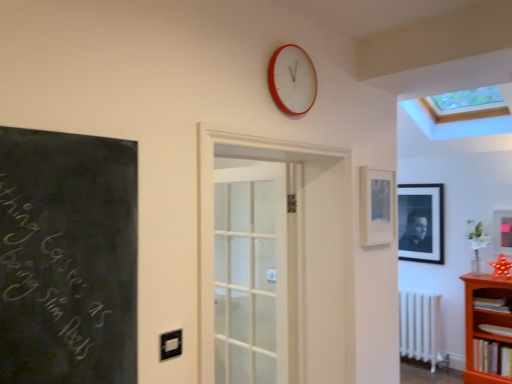
Question: Is transparent glass skylight at upper center outside red plastic wall clock at upper center?

Choices:
 (A) no
 (B) yes

Answer: (B)

Question: Is the position of transparent glass skylight at upper center less distant than that of red plastic wall clock at upper center?

Choices:
 (A) no
 (B) yes

Answer: (A)

Question: From the image's perspective, would you say transparent glass skylight at upper center is positioned over red plastic wall clock at upper center?

Choices:
 (A) no
 (B) yes

Answer: (B)

Question: Does transparent glass skylight at upper center appear on the left side of red plastic wall clock at upper center?

Choices:
 (A) no
 (B) yes

Answer: (A)

Question: From a real-world perspective, is transparent glass skylight at upper center positioned over red plastic wall clock at upper center based on gravity?

Choices:
 (A) yes
 (B) no

Answer: (A)

Question: Is transparent glass skylight at upper center shorter than red plastic wall clock at upper center?

Choices:
 (A) yes
 (B) no

Answer: (B)

Question: From a real-world perspective, is black matte picture frame at upper right, the third picture frame from the front, positioned over white glass door at center based on gravity?

Choices:
 (A) yes
 (B) no

Answer: (A)

Question: Is black matte picture frame at upper right, which is the second picture frame in right-to-left order, looking in the opposite direction of white glass door at center?

Choices:
 (A) no
 (B) yes

Answer: (A)

Question: Does black matte picture frame at upper right, which is the second picture frame in right-to-left order, appear on the left side of white glass door at center?

Choices:
 (A) no
 (B) yes

Answer: (A)

Question: Does black matte picture frame at upper right, the third picture frame from the front, lie in front of white glass door at center?

Choices:
 (A) no
 (B) yes

Answer: (A)

Question: From the image's perspective, is black matte picture frame at upper right, acting as the second picture frame starting from the left, located beneath white glass door at center?

Choices:
 (A) yes
 (B) no

Answer: (B)

Question: Is the position of black matte picture frame at upper right, acting as the second picture frame starting from the left, more distant than that of white glass door at center?

Choices:
 (A) no
 (B) yes

Answer: (B)

Question: From a real-world perspective, is red plastic wall clock at upper center located beneath matte black picture frame at right, which is the 2th picture frame from back to front?

Choices:
 (A) no
 (B) yes

Answer: (A)